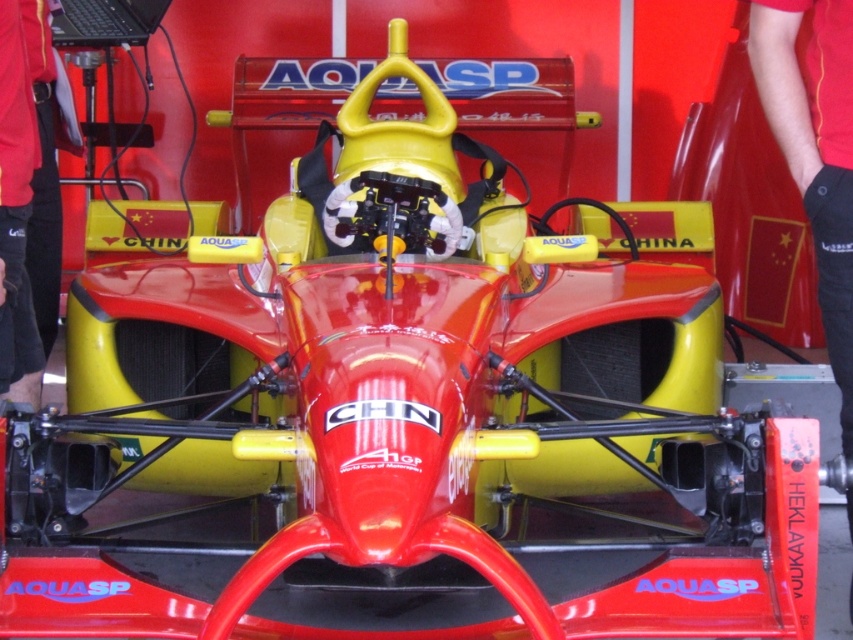
Does red cotton shirt at center have a lesser height compared to red fabric pants at lower left?

Incorrect, red cotton shirt at center's height does not fall short of red fabric pants at lower left's.

Which of these two, red cotton shirt at center or red fabric pants at lower left, stands taller?

red cotton shirt at center

Is point (799, 134) closer to viewer compared to point (35, 401)?

Yes.

Image resolution: width=853 pixels, height=640 pixels. Find the location of `red cotton shirt at center`. red cotton shirt at center is located at coordinates (815, 150).